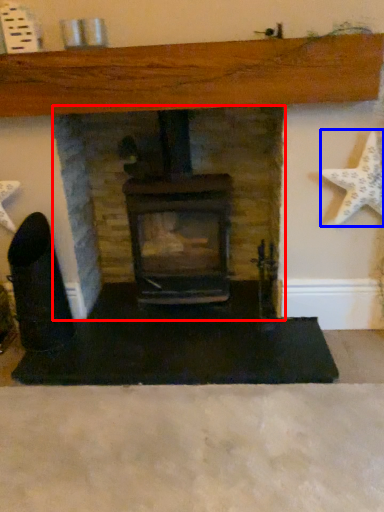
Question: Which point is further to the camera, fireplace (highlighted by a red box) or starfish (highlighted by a blue box)?

Choices:
 (A) fireplace
 (B) starfish

Answer: (A)